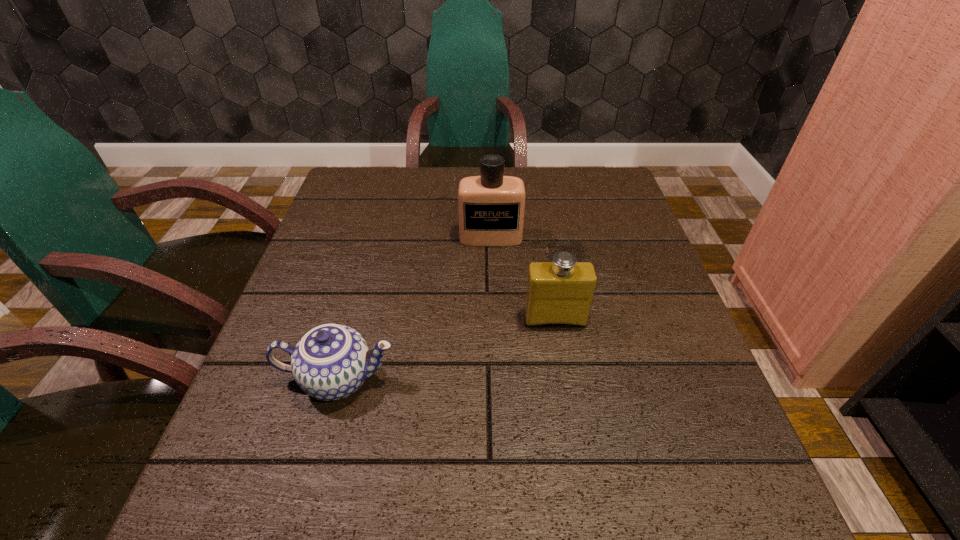
You are a GUI agent. You are given a task and a screenshot of the screen. Output one action in this format:
    pyautogui.click(x=<x>, y=<y>)
    Task: Click on the free space that satisfies the following two spatial constraints: 1. on the front-facing side of the nearer perfume; 2. at the spout of the leftmost object
    
    Given the screenshot: What is the action you would take?
    pyautogui.click(x=564, y=379)

At what (x,y) coordinates should I click in order to perform the action: click on free point that satisfies the following two spatial constraints: 1. on the front-facing side of the second farthest object; 2. at the spout of the leftmost object. Please return your answer as a coordinate pair (x, y). Looking at the image, I should click on (564, 379).